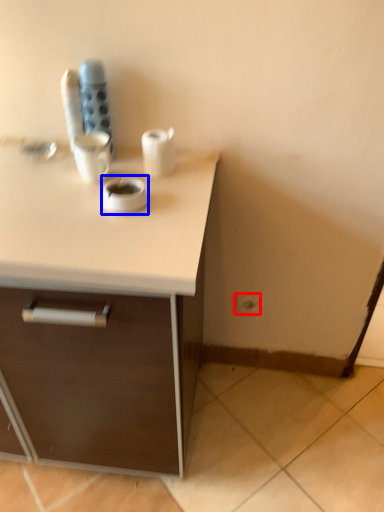
Question: Which of the following is the closest to the observer, electric outlet (highlighted by a red box) or coffee (highlighted by a blue box)?

Choices:
 (A) electric outlet
 (B) coffee

Answer: (B)